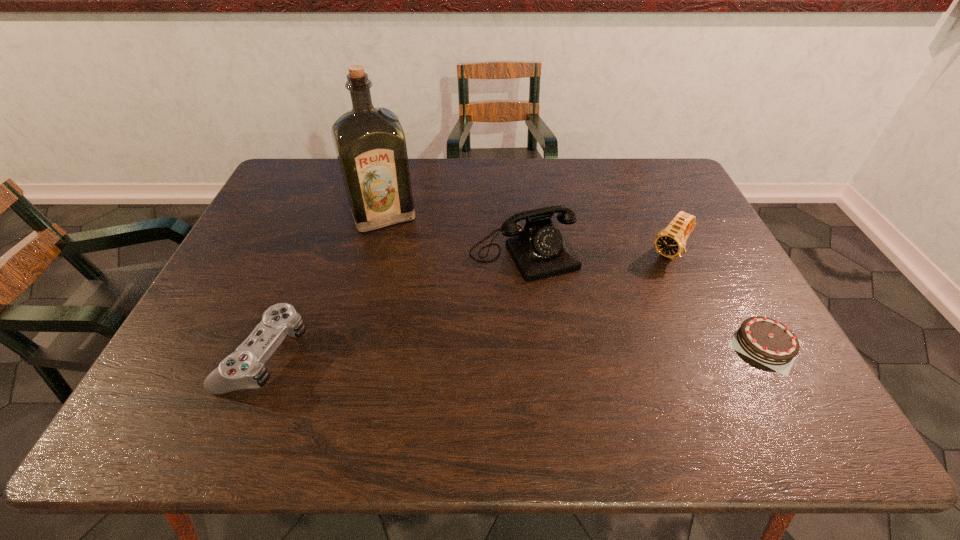
Identify the location of vacant space on the desktop that is between the fourth tallest object and the shortest object and is positioned on the label of the liquor. (443, 350).

At what (x,y) coordinates should I click in order to perform the action: click on free space on the desktop that is between the control and the chocolate cake and is positioned on the face of the watch. Please return your answer as a coordinate pair (x, y). Looking at the image, I should click on (588, 347).

Find the location of `vacant space on the desktop that is between the fourth tallest object and the shortest object and is positioned on the front face of the telephone`. vacant space on the desktop that is between the fourth tallest object and the shortest object and is positioned on the front face of the telephone is located at coordinates (578, 347).